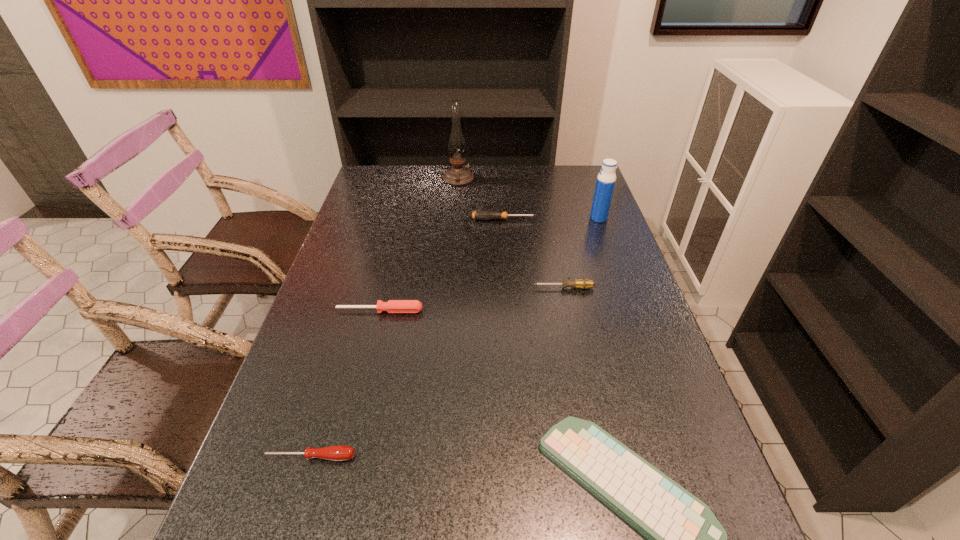
Locate an element on the screen. This screenshot has width=960, height=540. the tallest object is located at coordinates (458, 175).

At what (x,y) coordinates should I click in order to perform the action: click on oil lamp. Please return your answer as a coordinate pair (x, y). The image size is (960, 540). Looking at the image, I should click on (458, 175).

The image size is (960, 540). I want to click on the sixth shortest object, so click(606, 179).

At what (x,y) coordinates should I click in order to perform the action: click on the farthest screwdriver. Please return your answer as a coordinate pair (x, y). Looking at the image, I should click on (479, 214).

Identify the location of the fifth farthest object. The image size is (960, 540). (392, 306).

Identify the location of the third nearest screwdriver. This screenshot has height=540, width=960. (x=582, y=283).

At what (x,y) coordinates should I click in order to perform the action: click on the nearest screwdriver. Please return your answer as a coordinate pair (x, y). Looking at the image, I should click on (339, 452).

Locate an element on the screen. vacant space positioned 0.110m on the left of the oil lamp is located at coordinates (415, 179).

Locate an element on the screen. The width and height of the screenshot is (960, 540). free location located 0.070m on the front of the second tallest object is located at coordinates (605, 235).

Locate an element on the screen. The width and height of the screenshot is (960, 540). vacant space situated on the front of the farthest screwdriver is located at coordinates (509, 284).